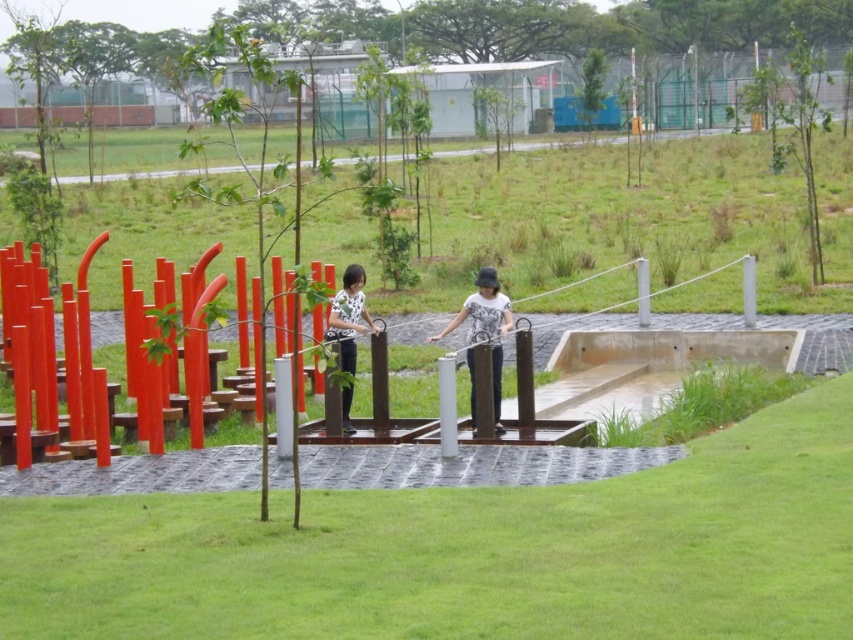
Looking at this image, does metallic silver rope bridge at center have a lesser height compared to white matte shirt at center?

Incorrect, metallic silver rope bridge at center's height does not fall short of white matte shirt at center's.

Can you confirm if metallic silver rope bridge at center is taller than white matte shirt at center?

Correct, metallic silver rope bridge at center is much taller as white matte shirt at center.

Is point (154, 353) positioned behind point (473, 381)?

No, (154, 353) is closer to viewer.

Where is `metallic silver rope bridge at center`? The height and width of the screenshot is (640, 853). metallic silver rope bridge at center is located at coordinates (55, 388).

Can you confirm if metallic silver rope bridge at center is wider than white dotted shirt at center?

Yes.

The image size is (853, 640). I want to click on metallic silver rope bridge at center, so click(55, 388).

In the scene shown: Is white matte shirt at center further to the viewer compared to white dotted shirt at center?

No.

Between white matte shirt at center and white dotted shirt at center, which one has less height?

white matte shirt at center is shorter.

Is point (477, 316) more distant than point (345, 278)?

No, (477, 316) is in front of (345, 278).

Identify the location of white matte shirt at center. The image size is (853, 640). (486, 326).